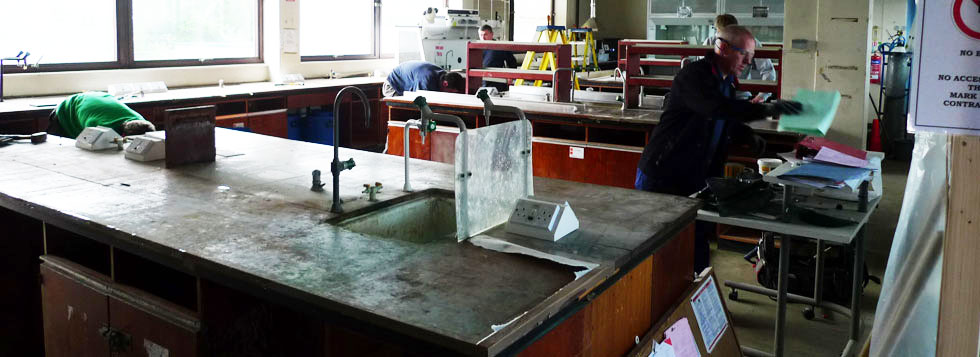
What are the coordinates of `table` in the screenshot? It's located at (821, 226).